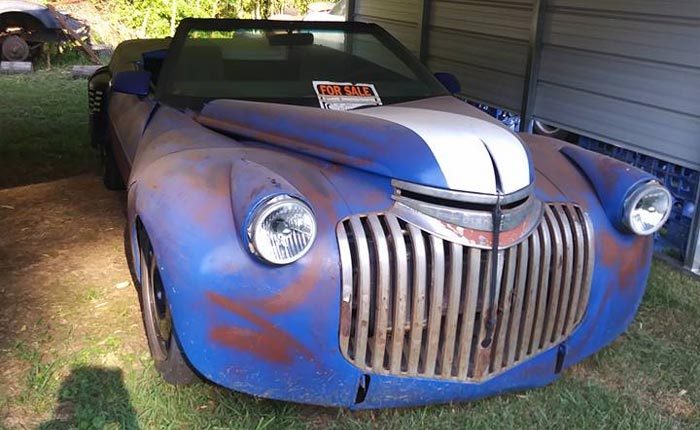
Where is `garage wall`? The width and height of the screenshot is (700, 430). garage wall is located at coordinates (644, 83).